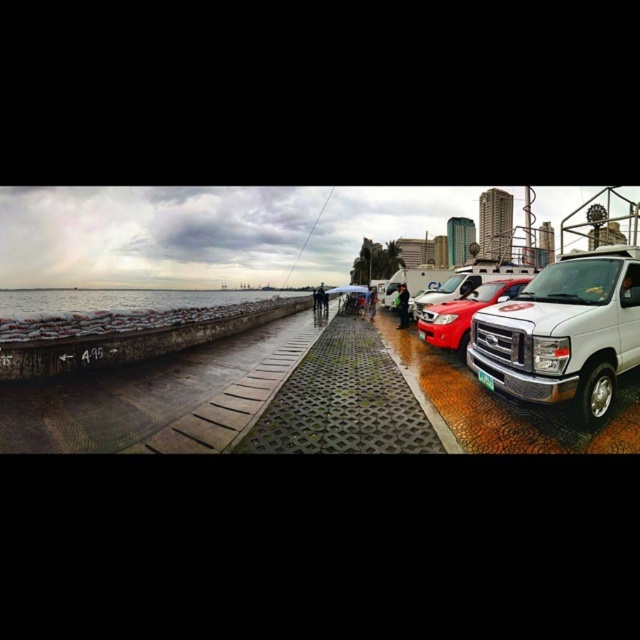
Question: Estimate the real-world distances between objects in this image. Which object is farther from the shiny red car at center?

Choices:
 (A) matte white van at right
 (B) green plastic license plate at center
 (C) green textured pavement at center
 (D) concrete textured pavement at lower left

Answer: (D)

Question: Does green textured pavement at center have a smaller size compared to green plastic license plate at center?

Choices:
 (A) no
 (B) yes

Answer: (B)

Question: Based on their relative distances, which object is farther from the concrete textured pavement at lower left?

Choices:
 (A) green textured pavement at center
 (B) shiny red car at center
 (C) green plastic license plate at center
 (D) matte white van at right

Answer: (A)

Question: Can you confirm if concrete textured pavement at lower left is positioned to the left of green plastic license plate at center?

Choices:
 (A) yes
 (B) no

Answer: (A)

Question: Can you confirm if concrete textured pavement at lower left is positioned to the right of green plastic license plate at center?

Choices:
 (A) no
 (B) yes

Answer: (A)

Question: Which is farther from the green textured pavement at center?

Choices:
 (A) green plastic license plate at center
 (B) concrete textured pavement at lower left

Answer: (B)